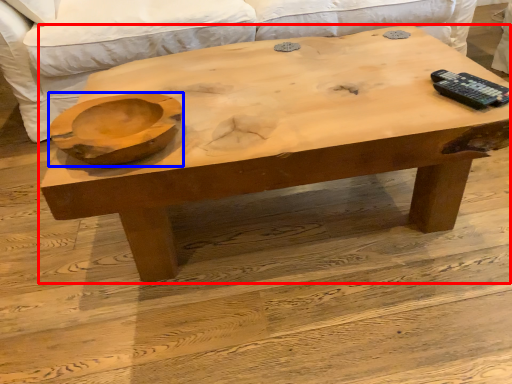
Question: Which of the following is the closest to the observer, coffee table (highlighted by a red box) or bowl (highlighted by a blue box)?

Choices:
 (A) coffee table
 (B) bowl

Answer: (B)